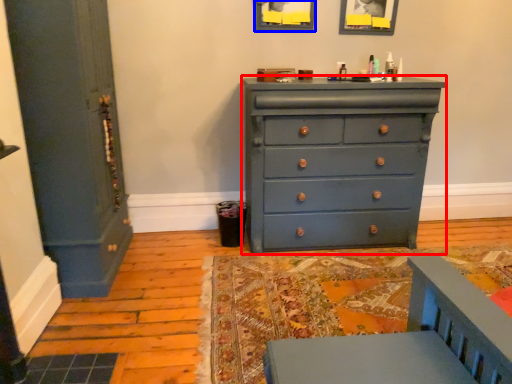
Question: Which object appears farthest to the camera in this image, chest of drawers (highlighted by a red box) or picture frame (highlighted by a blue box)?

Choices:
 (A) chest of drawers
 (B) picture frame

Answer: (B)